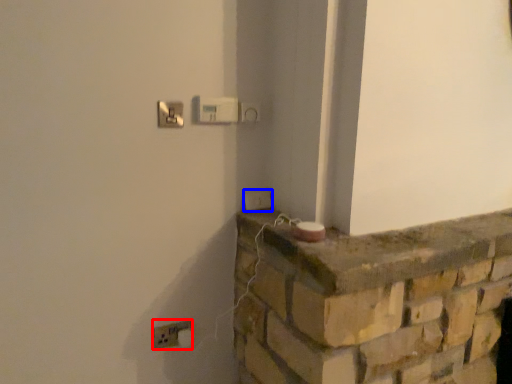
Question: Among these objects, which one is farthest to the camera, electric outlet (highlighted by a red box) or light switch (highlighted by a blue box)?

Choices:
 (A) electric outlet
 (B) light switch

Answer: (B)